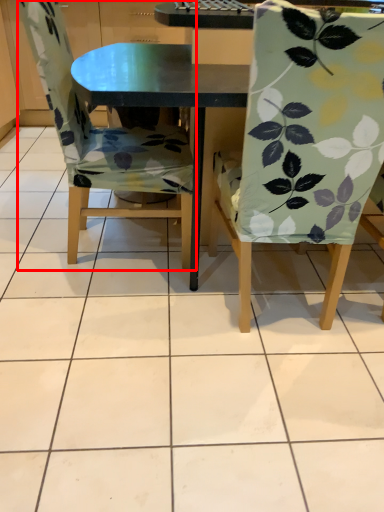
Question: From the image's perspective, where is chair (annotated by the red box) located relative to chair?

Choices:
 (A) above
 (B) below

Answer: (A)